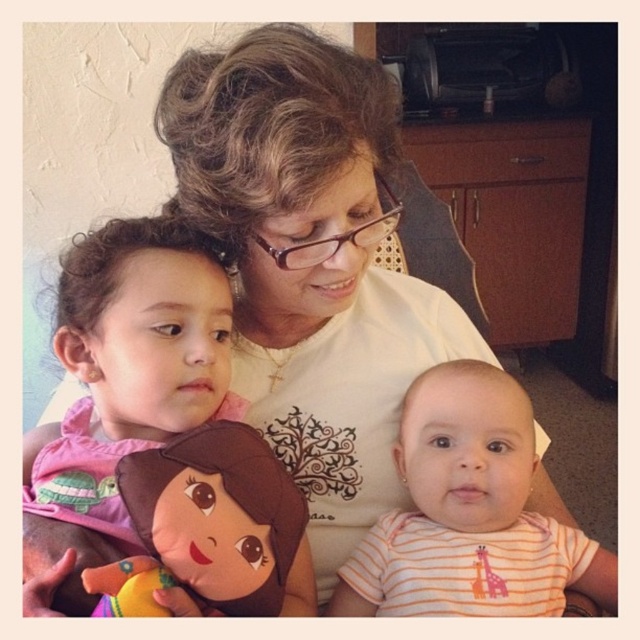
You are standing in the living room and want to move from point A to point B. Point A is at coordinate point(132, 278) and point B is at coordinate point(152, 582). Which point is closer to you?

Point A at coordinate point(132, 278) is closer to you because it is further to the viewer than point B at coordinate point(152, 582).

You are a photographer standing in front of the scene. You want to take a closeup photo of the pink fabric doll at left. The camera you are using has a minimum focusing distance of 20 inches. Can you take the photo without moving the doll?

The pink fabric doll at left is 22.66 inches away from the viewer. Since the camera can focus as close as 20 inches, you can take the photo without moving the doll because the distance is within the camera s minimum focusing range.